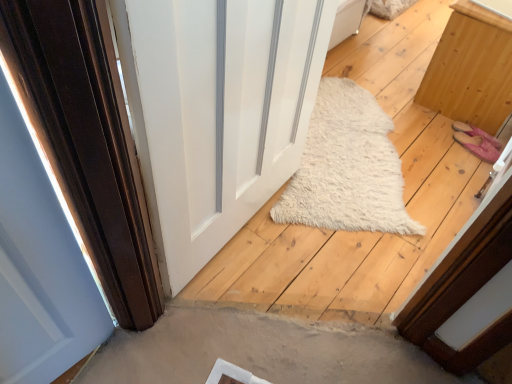
Question: Is light brown wood cabinet at right positioned beyond the bounds of white glossy door at center?

Choices:
 (A) yes
 (B) no

Answer: (A)

Question: Is light brown wood cabinet at right wider than white glossy door at center?

Choices:
 (A) no
 (B) yes

Answer: (B)

Question: Considering the relative sizes of light brown wood cabinet at right and white glossy door at center in the image provided, is light brown wood cabinet at right shorter than white glossy door at center?

Choices:
 (A) yes
 (B) no

Answer: (A)

Question: Is light brown wood cabinet at right smaller than white glossy door at center?

Choices:
 (A) no
 (B) yes

Answer: (A)

Question: Is light brown wood cabinet at right placed right next to white glossy door at center?

Choices:
 (A) no
 (B) yes

Answer: (A)

Question: Does light brown wood cabinet at right turn towards white glossy door at center?

Choices:
 (A) no
 (B) yes

Answer: (A)

Question: Is white glossy door at center to the right of light brown wood cabinet at right from the viewer's perspective?

Choices:
 (A) yes
 (B) no

Answer: (B)

Question: Does white glossy door at center have a lesser width compared to light brown wood cabinet at right?

Choices:
 (A) no
 (B) yes

Answer: (B)

Question: Is light brown wood cabinet at right a part of white glossy door at center?

Choices:
 (A) yes
 (B) no

Answer: (B)

Question: Is white glossy door at center looking in the opposite direction of light brown wood cabinet at right?

Choices:
 (A) no
 (B) yes

Answer: (A)

Question: Is white glossy door at center shorter than light brown wood cabinet at right?

Choices:
 (A) yes
 (B) no

Answer: (B)

Question: Is white glossy door at center at the left side of light brown wood cabinet at right?

Choices:
 (A) no
 (B) yes

Answer: (B)

Question: From the image's perspective, relative to light brown wood cabinet at right, is white glossy door at center above or below?

Choices:
 (A) above
 (B) below

Answer: (B)